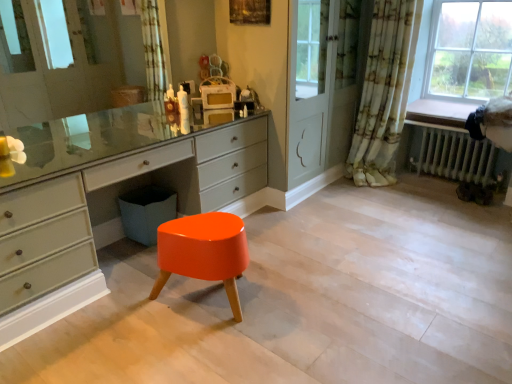
Question: Is the surface of metallic radiator at lower right in direct contact with matte gray chest of drawers at center?

Choices:
 (A) yes
 (B) no

Answer: (B)

Question: Does metallic radiator at lower right have a smaller size compared to matte gray chest of drawers at center?

Choices:
 (A) no
 (B) yes

Answer: (B)

Question: Does metallic radiator at lower right have a greater height compared to matte gray chest of drawers at center?

Choices:
 (A) yes
 (B) no

Answer: (B)

Question: Is metallic radiator at lower right thinner than matte gray chest of drawers at center?

Choices:
 (A) no
 (B) yes

Answer: (A)

Question: From the image's perspective, is metallic radiator at lower right beneath matte gray chest of drawers at center?

Choices:
 (A) yes
 (B) no

Answer: (B)

Question: Is metallic radiator at lower right not within matte gray chest of drawers at center?

Choices:
 (A) yes
 (B) no

Answer: (A)

Question: Can we say glossy orange stool at center lies outside matte gray chest of drawers at center?

Choices:
 (A) no
 (B) yes

Answer: (B)

Question: Is the depth of glossy orange stool at center less than that of matte gray chest of drawers at center?

Choices:
 (A) no
 (B) yes

Answer: (A)

Question: Considering the relative sizes of glossy orange stool at center and matte gray chest of drawers at center in the image provided, is glossy orange stool at center shorter than matte gray chest of drawers at center?

Choices:
 (A) no
 (B) yes

Answer: (B)

Question: Is glossy orange stool at center oriented towards matte gray chest of drawers at center?

Choices:
 (A) no
 (B) yes

Answer: (B)

Question: From a real-world perspective, is glossy orange stool at center physically below matte gray chest of drawers at center?

Choices:
 (A) no
 (B) yes

Answer: (B)

Question: Does glossy orange stool at center have a lesser width compared to matte gray chest of drawers at center?

Choices:
 (A) yes
 (B) no

Answer: (B)

Question: Is glossy orange stool at center completely or partially outside of floral fabric curtain at right?

Choices:
 (A) yes
 (B) no

Answer: (A)